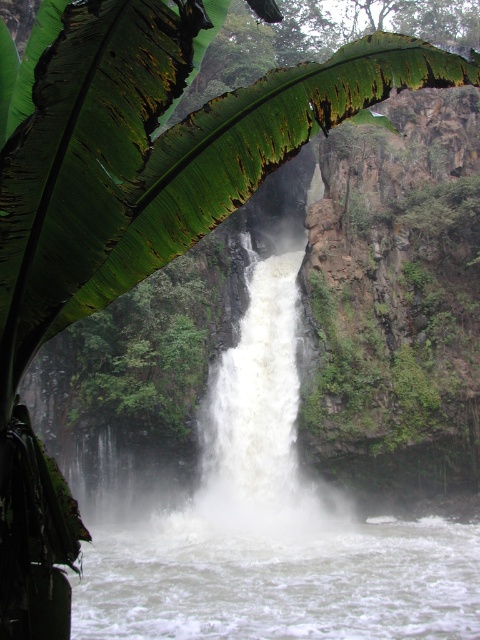
Which of these two, green leafy banana leaf at upper left or white frothy water at center, stands shorter?

With less height is green leafy banana leaf at upper left.

Between green leafy banana leaf at upper left and white frothy water at center, which one has more height?

With more height is white frothy water at center.

Between point (276, 120) and point (291, 496), which one is positioned behind?

The point (291, 496) is behind.

This screenshot has width=480, height=640. In order to click on green leafy banana leaf at upper left in this screenshot , I will do `click(250, 150)`.